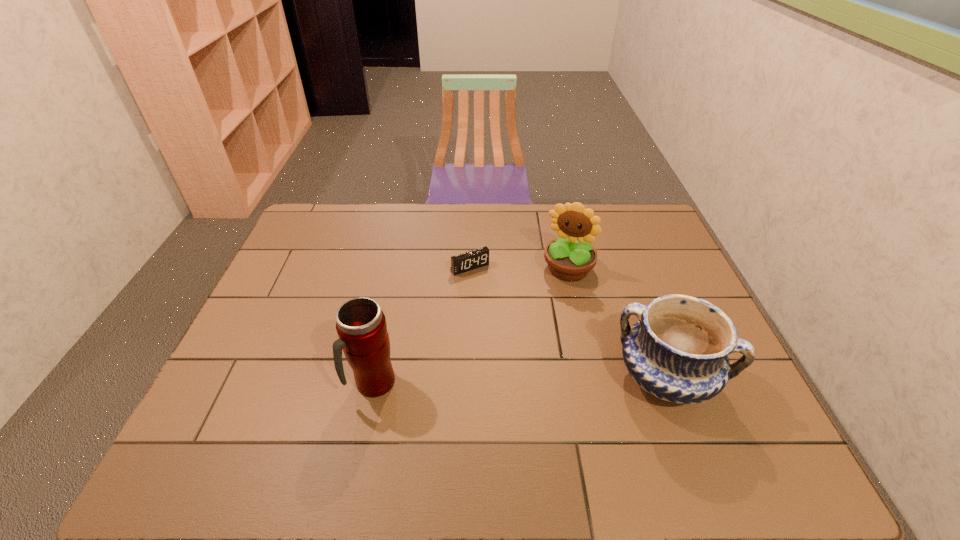
Find the location of a particular element. This screenshot has height=540, width=960. vacant region located 0.290m on the face of the sunflower is located at coordinates [528, 353].

At what (x,y) coordinates should I click in order to perform the action: click on blank space located on the face of the sunflower. Please return your answer as a coordinate pair (x, y). This screenshot has width=960, height=540. Looking at the image, I should click on (522, 365).

Where is `free region located on the face of the sunflower`? This screenshot has width=960, height=540. free region located on the face of the sunflower is located at coordinates (550, 306).

This screenshot has width=960, height=540. I want to click on thermos bottle located at the near edge, so click(x=361, y=325).

Identify the location of pottery that is at the near edge. (678, 351).

Where is `object that is at the right edge`? object that is at the right edge is located at coordinates (678, 351).

This screenshot has height=540, width=960. In order to click on object that is positioned at the near right corner in this screenshot , I will do `click(678, 351)`.

The width and height of the screenshot is (960, 540). In order to click on vacant area at the far edge in this screenshot , I will do `click(453, 215)`.

This screenshot has width=960, height=540. Identify the location of vacant space at the near edge. (338, 400).

Locate an element on the screen. free region at the left edge is located at coordinates (284, 280).